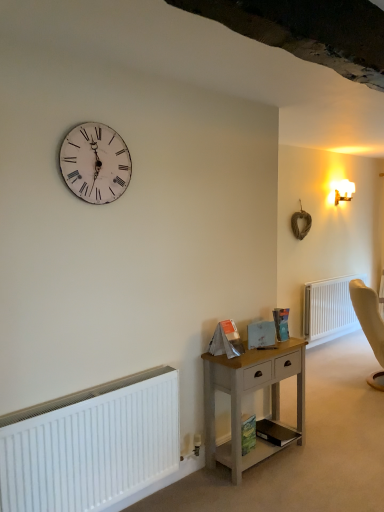
Identify the location of vacant space in front of white plastic radiator at lower right, arranged as the first radiator when viewed from the right. (336, 360).